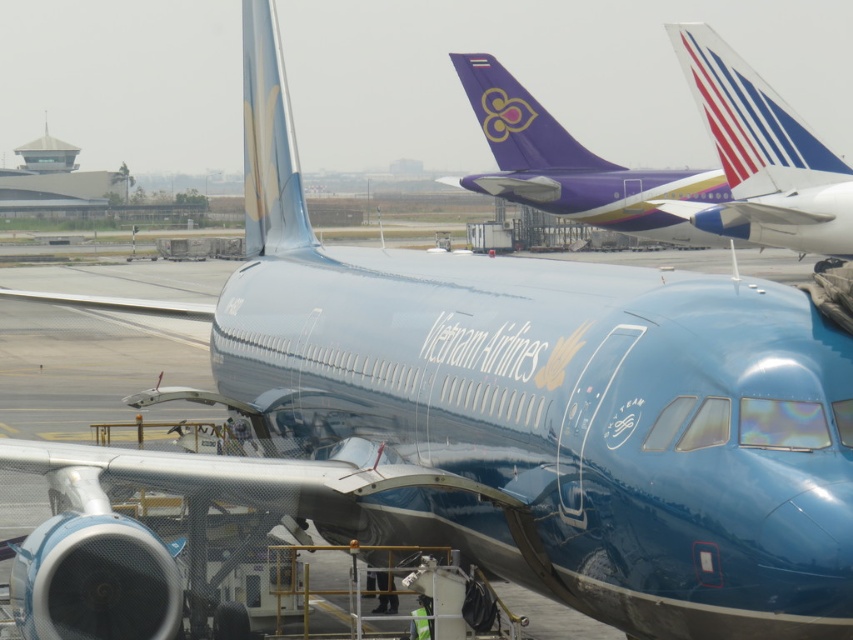
You are an airport maintenance worker and need to locate the blue glossy tail at upper right for inspection. According to the coordinates provided, where exactly should you look on the image to find it?

The blue glossy tail at upper right is located at the coordinates point (761, 156) on the image.

You are an airport ground crew member checking the positioning of the aircraft. You notice the metallic purple airplane at upper center and the glossy blue tail at center. Which one is positioned to the right side of the other?

The metallic purple airplane at upper center is positioned to the right of the glossy blue tail at center.

You are standing at the airport gate looking at the Vietnam Airlines aircraft. There is a point labeled at coordinates (761, 156). What part of the aircraft does this point correspond to?

The point at (761, 156) corresponds to the blue glossy tail at upper right of the aircraft.